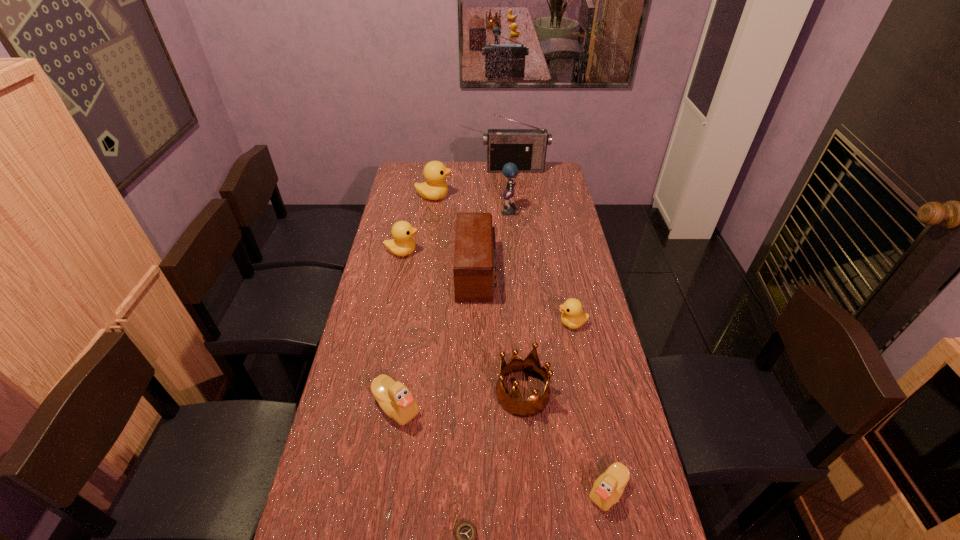
Find the location of a particular element. the farther beige duck is located at coordinates (394, 398).

The image size is (960, 540). Find the location of `the left beige duck`. the left beige duck is located at coordinates (394, 398).

Image resolution: width=960 pixels, height=540 pixels. Identify the location of the smallest yellow duck. (572, 316).

At what (x,y) coordinates should I click in order to perform the action: click on the nearest yellow duck. Please return your answer as a coordinate pair (x, y). This screenshot has width=960, height=540. Looking at the image, I should click on (572, 316).

The image size is (960, 540). What are the coordinates of `the right beige duck` in the screenshot? It's located at (608, 488).

Where is `the nearer beige duck`? the nearer beige duck is located at coordinates (608, 488).

Locate an element on the screen. free location located on the front-facing side of the farther radio receiver is located at coordinates (517, 184).

The height and width of the screenshot is (540, 960). Identify the location of vacant position located 0.300m on the front-facing side of the eighth nearest object. (435, 213).

The height and width of the screenshot is (540, 960). Identify the location of vacant space located on the front-facing side of the eighth nearest object. (429, 213).

I want to click on free location located 0.050m on the front-facing side of the eighth nearest object, so click(490, 213).